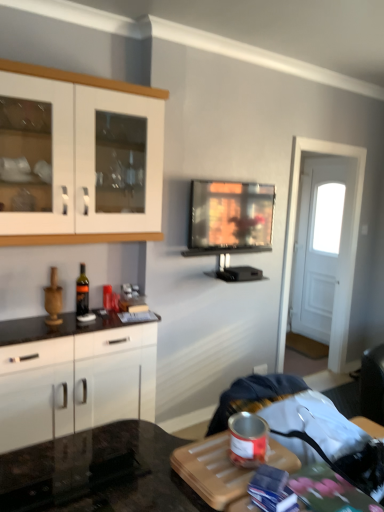
Question: Should I look upward or downward to see white glossy cabinet at left, marked as the 2th cabinetry in a top-to-bottom arrangement?

Choices:
 (A) up
 (B) down

Answer: (B)

Question: Is white wooden door at right smaller than white glossy cabinet at left, marked as the 2th cabinetry in a top-to-bottom arrangement?

Choices:
 (A) no
 (B) yes

Answer: (B)

Question: Can you confirm if white wooden door at right is positioned to the right of white glossy cabinet at left, which ranks as the 1th cabinetry in bottom-to-top order?

Choices:
 (A) no
 (B) yes

Answer: (B)

Question: Is white wooden door at right outside white glossy cabinet at left, marked as the 2th cabinetry in a top-to-bottom arrangement?

Choices:
 (A) yes
 (B) no

Answer: (A)

Question: Is the depth of white wooden door at right greater than that of white glossy cabinet at left, marked as the 2th cabinetry in a top-to-bottom arrangement?

Choices:
 (A) no
 (B) yes

Answer: (B)

Question: Does white wooden door at right have a larger size compared to white glossy cabinet at left, marked as the 2th cabinetry in a top-to-bottom arrangement?

Choices:
 (A) yes
 (B) no

Answer: (B)

Question: From a real-world perspective, is white wooden door at right on top of white glossy cabinet at left, which ranks as the 1th cabinetry in bottom-to-top order?

Choices:
 (A) yes
 (B) no

Answer: (A)

Question: Can we say white glossy cabinet at upper left, marked as the 2th cabinetry in a bottom-to-top arrangement, lies outside flat screen tv at center?

Choices:
 (A) yes
 (B) no

Answer: (A)

Question: Is white glossy cabinet at upper left, marked as the 2th cabinetry in a bottom-to-top arrangement, wider than flat screen tv at center?

Choices:
 (A) no
 (B) yes

Answer: (B)

Question: From a real-world perspective, is white glossy cabinet at upper left, marked as the 2th cabinetry in a bottom-to-top arrangement, under flat screen tv at center?

Choices:
 (A) no
 (B) yes

Answer: (A)

Question: Is white glossy cabinet at upper left, marked as the 2th cabinetry in a bottom-to-top arrangement, to the left of flat screen tv at center from the viewer's perspective?

Choices:
 (A) no
 (B) yes

Answer: (B)

Question: Does white glossy cabinet at upper left, the first cabinetry positioned from the top, have a larger size compared to flat screen tv at center?

Choices:
 (A) yes
 (B) no

Answer: (A)

Question: Would you say white glossy cabinet at upper left, marked as the 2th cabinetry in a bottom-to-top arrangement, contains flat screen tv at center?

Choices:
 (A) no
 (B) yes

Answer: (A)

Question: Could you tell me if white wooden door at right is turned towards flat screen tv at center?

Choices:
 (A) yes
 (B) no

Answer: (B)